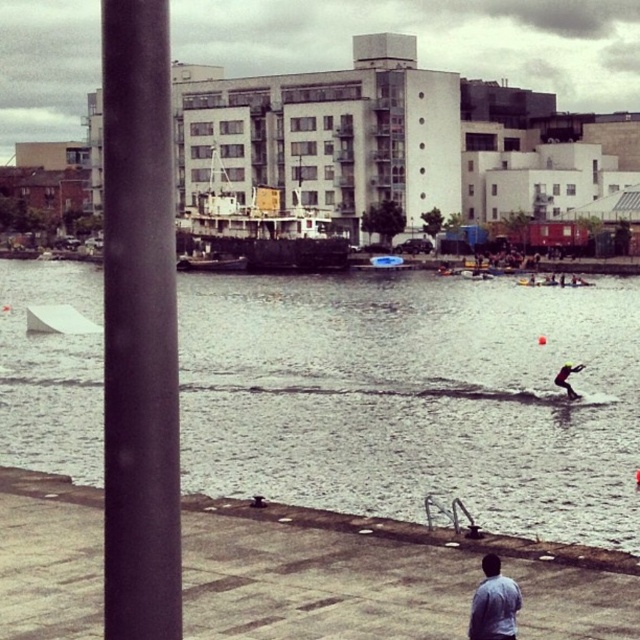
Who is positioned more to the right, gray concrete water at center or wooden ship at center?

gray concrete water at center is more to the right.

Identify the location of gray concrete water at center. (416, 397).

Does concrete at lower center have a lesser width compared to wooden ship at center?

Yes.

This screenshot has height=640, width=640. I want to click on concrete at lower center, so [380, 579].

What are the coordinates of `concrete at lower center` in the screenshot? It's located at (380, 579).

How much distance is there between concrete at lower center and metallic gray boat at center?

They are 379.57 feet apart.

Can you confirm if concrete at lower center is positioned to the left of metallic gray boat at center?

Incorrect, concrete at lower center is not on the left side of metallic gray boat at center.

Between point (35, 476) and point (189, 262), which one is positioned behind?

Positioned behind is point (189, 262).

Find the location of `concrete at lower center`. concrete at lower center is located at coordinates (380, 579).